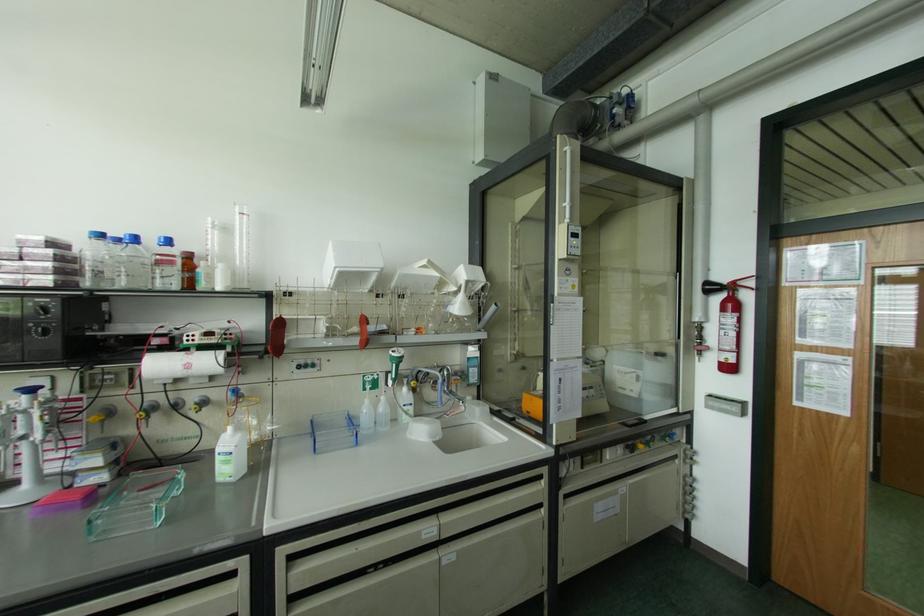
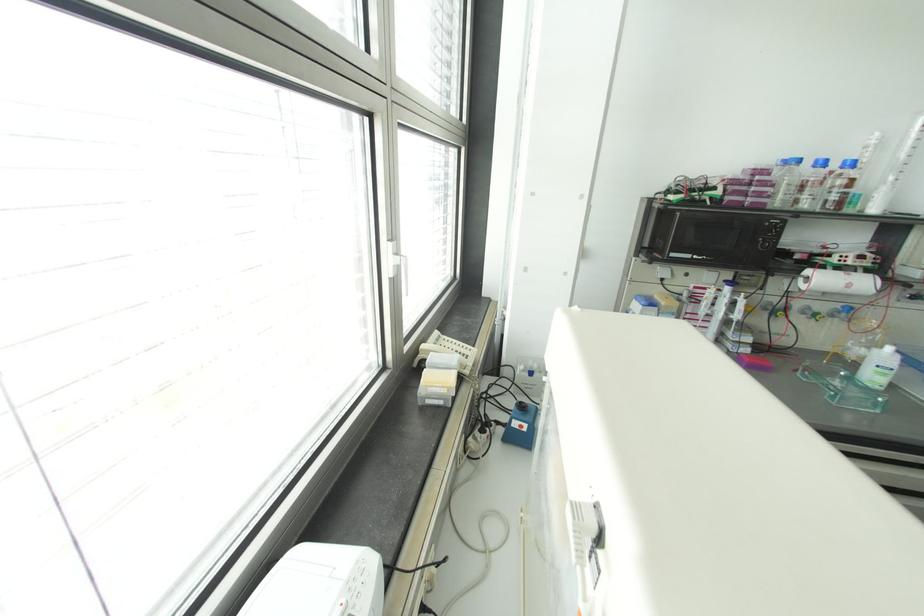
The point at (235, 391) is marked in the first image. Where is the corresponding point in the second image?

(848, 309)